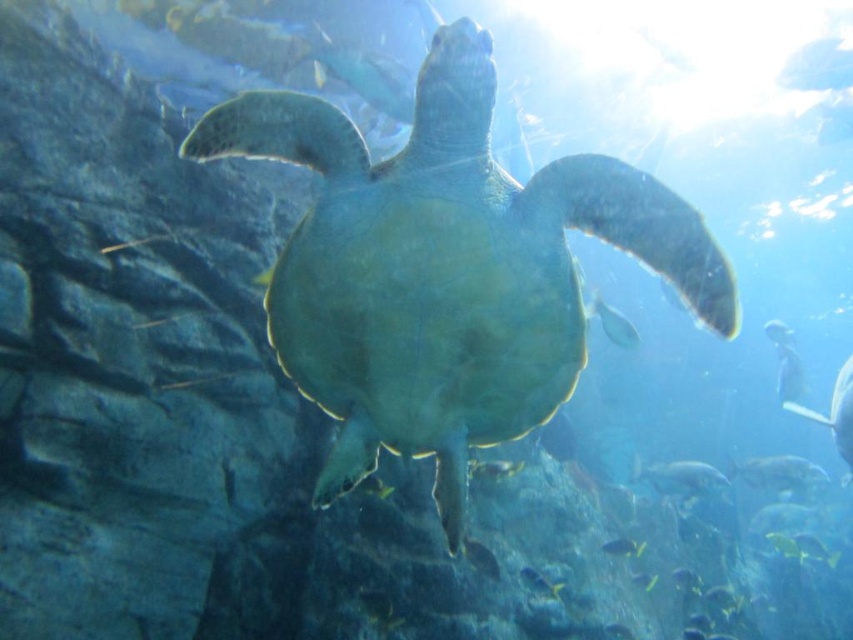
You are a scuba diver swimming underwater and see the point marked at coordinates (778, 472). What is located at that point?

The point at coordinates (778, 472) marks a translucent white fish at lower right.

You are a marine biologist observing the underwater scene. You need to place a 5 meter long measuring tape between the translucent white fish at lower right and the shiny silver fish at center. Will the tape be long enough to reach both ends?

The translucent white fish at lower right and shiny silver fish at center are 4.38 meters apart from each other. Since the measuring tape is 5 meters long, it will be long enough to reach both ends.